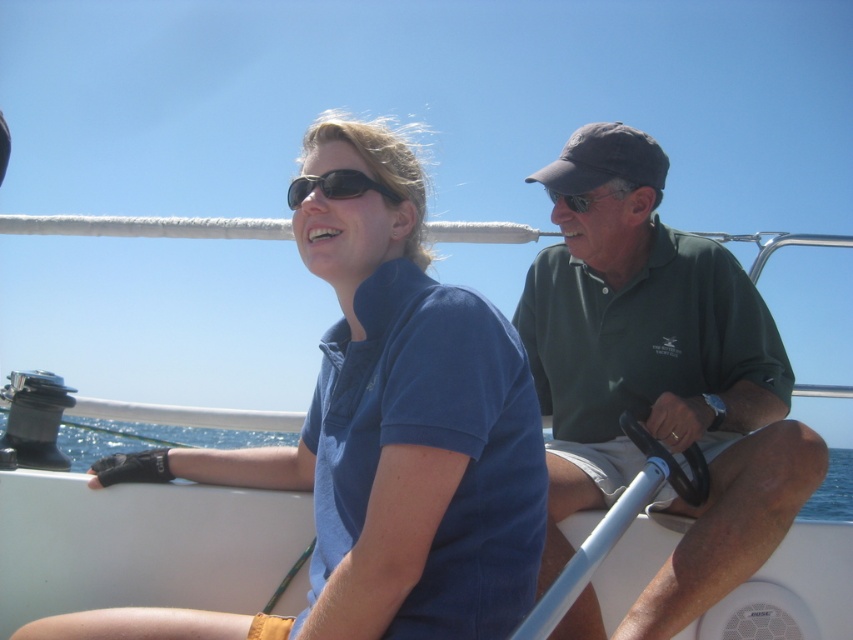
Consider the image. Is blue cotton shirt at center in front of matte black sunglasses at center?

Yes, it is.

Who is more forward, (496, 403) or (352, 186)?

Point (496, 403) is more forward.

The height and width of the screenshot is (640, 853). What do you see at coordinates (381, 436) in the screenshot?
I see `blue cotton shirt at center` at bounding box center [381, 436].

Where is `blue cotton shirt at center`? The image size is (853, 640). blue cotton shirt at center is located at coordinates (381, 436).

Which of these two, green cotton shirt at right or blue water at lower left, stands shorter?

blue water at lower left

Does green cotton shirt at right appear on the right side of blue water at lower left?

Yes, green cotton shirt at right is to the right of blue water at lower left.

Where is `green cotton shirt at right`? green cotton shirt at right is located at coordinates (657, 376).

Is blue water at lower left below matte black sunglasses at center?

Yes.

Between point (811, 500) and point (306, 177), which one is positioned behind?

The point (811, 500) is more distant.

The width and height of the screenshot is (853, 640). In order to click on blue water at lower left in this screenshot , I will do (149, 438).